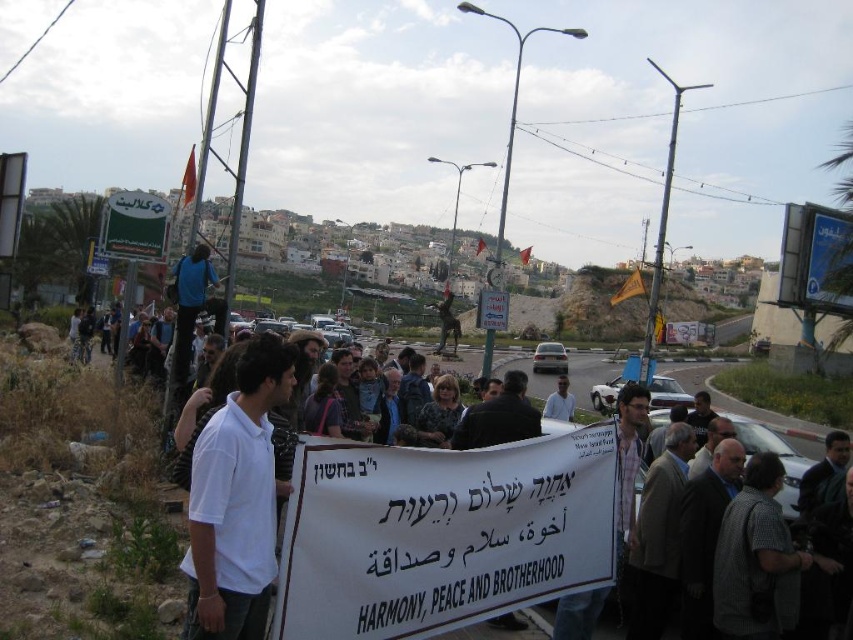
Does point (204, 577) come behind point (535, 381)?

No, it is not.

Which is in front, point (244, 582) or point (763, 429)?

Point (244, 582) is more forward.

This screenshot has width=853, height=640. Find the location of `white cotton shirt at center`. white cotton shirt at center is located at coordinates (236, 499).